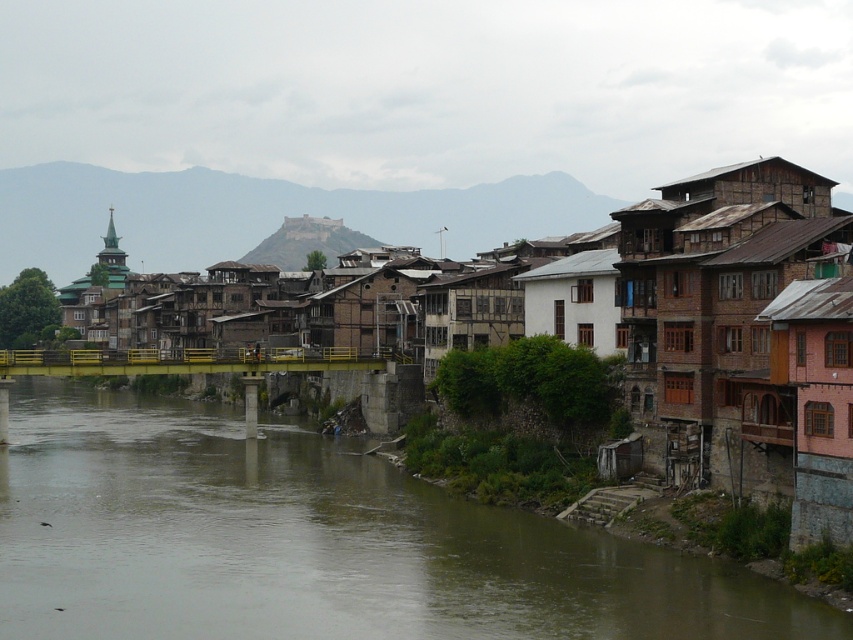
You are a tourist standing on the yellow pedestrian bridge and want to take a photo that includes both the brown concrete river at lower left and the white wooden house at center. Which object will appear wider in the photo?

The brown concrete river at lower left will appear wider in the photo because its width surpasses that of the white wooden house at center according to the description.

You are a delivery drone with a maximum flight range of 60 feet. You need to deliver a package from the brown concrete river at lower left to the brown wooden houses at center. Can you complete the delivery without needing to recharge?

The distance between the brown concrete river at lower left and the brown wooden houses at center is 62.22 feet, which exceeds the drone s 60 feet maximum flight range. Therefore, the drone cannot complete the delivery without recharging.

You are a tourist planning to cross the river using the yellow pedestrian bridge. You need to know if the brown concrete river at lower left is wider than the wooden hut at center. Can you confirm this?

The brown concrete river at lower left is wider than the wooden hut at center, so yes, the river is wider than the wooden hut.